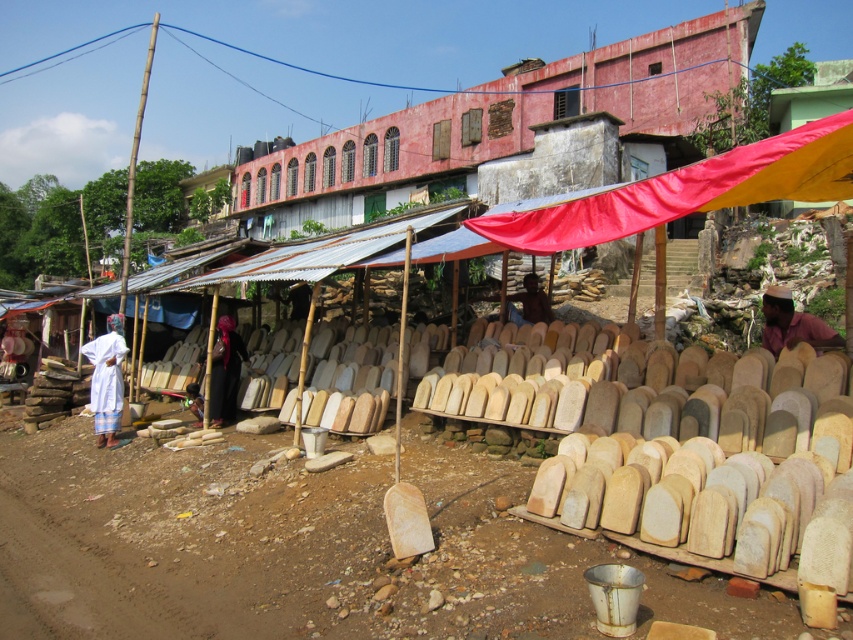
You are a customer at the market and want to buy both the white cloth at left and the brown skin at center. Which item takes up more space on the stall?

The white cloth at left has a larger size compared to brown skin at center, so it takes up more space on the stall.

You are a customer at the market and want to buy a fabric. You see the red fabric canopy at center and the brown fabric at right. Which fabric is closer to the right side of the market stall?

The brown fabric at right is closer to the right side of the market stall because it is positioned to the right of the red fabric canopy at center.